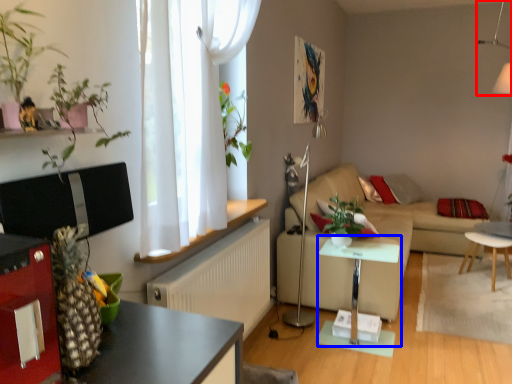
Question: Which of the following is the closest to the observer, lamp (highlighted by a red box) or table (highlighted by a blue box)?

Choices:
 (A) lamp
 (B) table

Answer: (B)